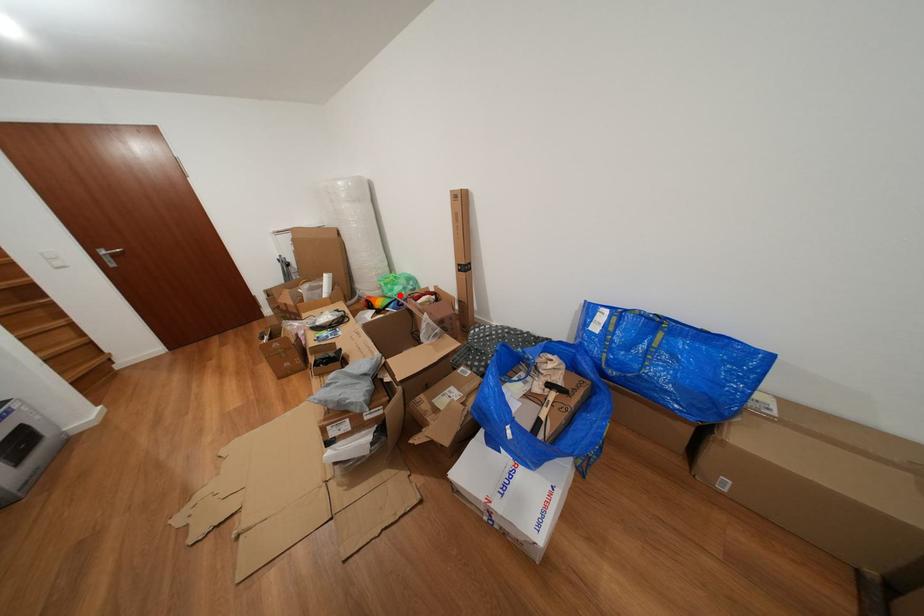
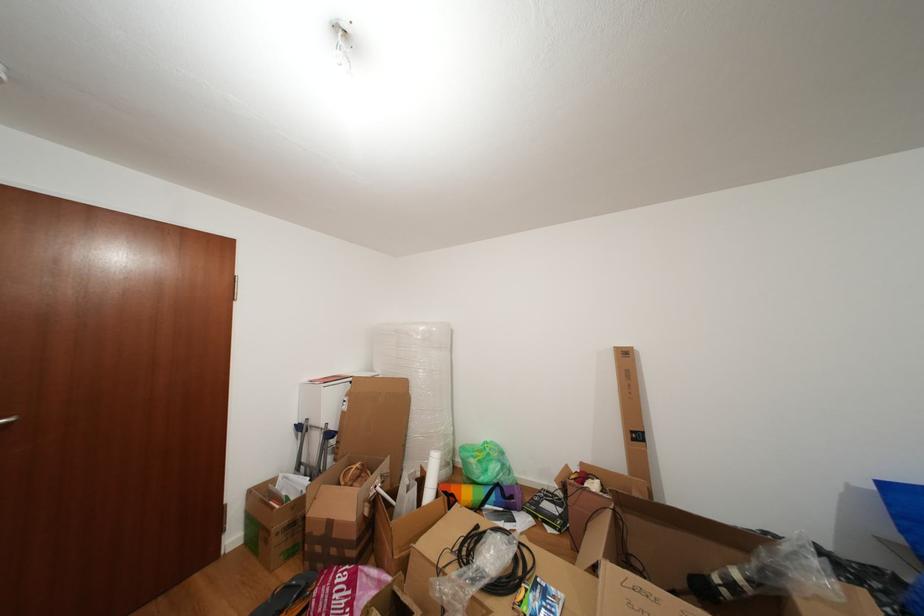
Find the pixel in the second image that matches the highlighted location in the first image.

(494, 476)